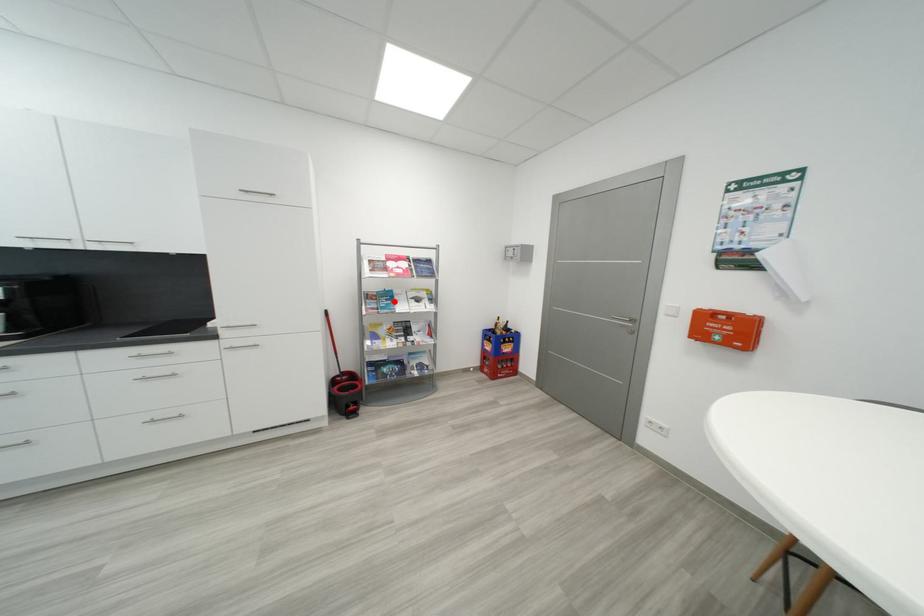
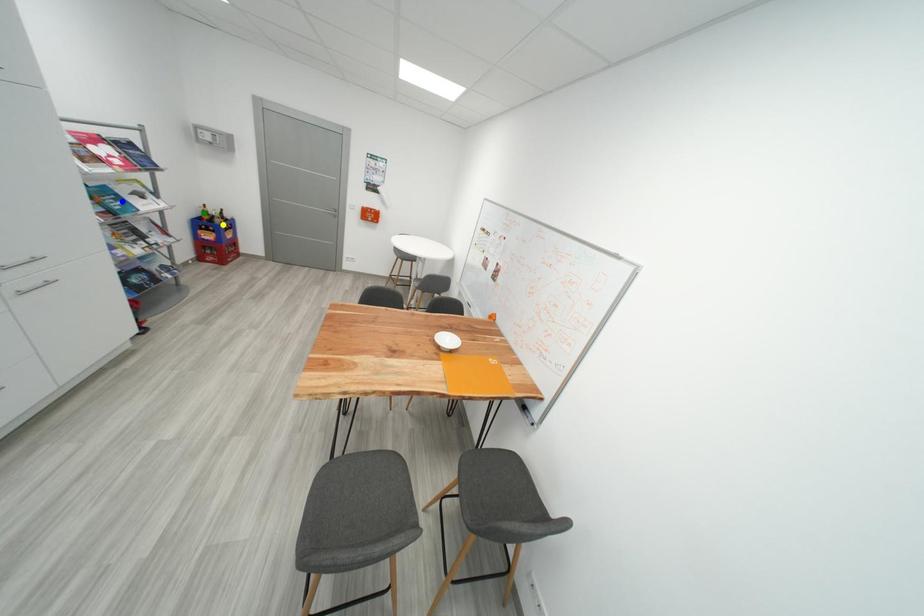
Question: I am providing you with two images of the same scene from different viewpoints. A red point is marked on the first image. You are given multiple points on the second image. Can you choose the point in image 2 that corresponds to the point in image 1?

Choices:
 (A) green point
 (B) yellow point
 (C) blue point

Answer: (C)